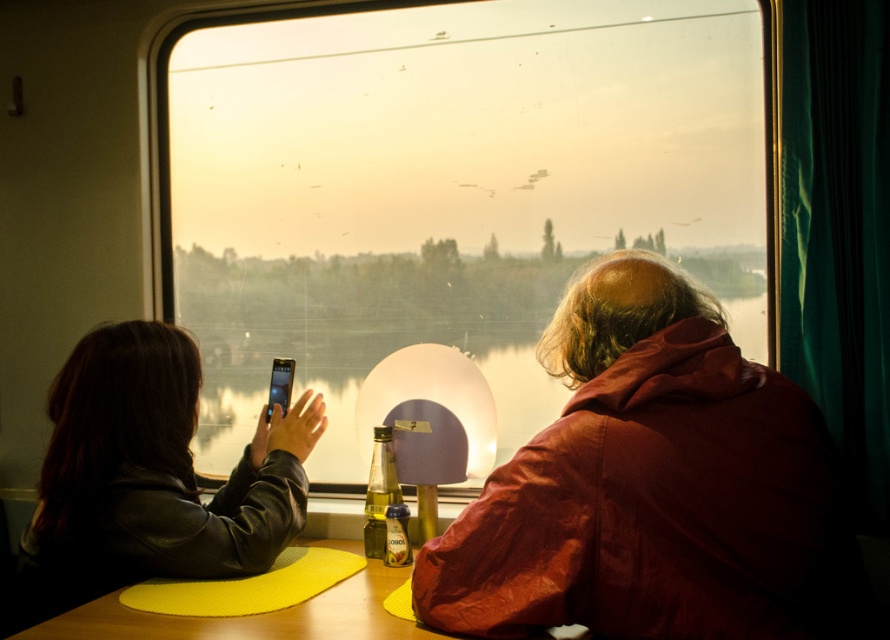
Identify the location of matte red jacket at center. The image size is (890, 640). (653, 486).

Who is higher up, matte red jacket at center or transparent glass water at center?

transparent glass water at center is above.

Does point (795, 536) lie behind point (425, 340)?

No.

Locate an element on the screen. matte red jacket at center is located at coordinates (653, 486).

This screenshot has height=640, width=890. In order to click on transparent glass train window at center in this screenshot , I will do `click(450, 189)`.

Is transparent glass train window at center smaller than leather jacket at left?

No.

Describe the element at coordinates (450, 189) in the screenshot. This screenshot has width=890, height=640. I see `transparent glass train window at center` at that location.

Identify the location of transparent glass train window at center. The image size is (890, 640). tap(450, 189).

Is transparent glass train window at center smaller than translucent glass bottle at center?

Incorrect, transparent glass train window at center is not smaller in size than translucent glass bottle at center.

Describe the element at coordinates (450, 189) in the screenshot. Image resolution: width=890 pixels, height=640 pixels. I see `transparent glass train window at center` at that location.

Between point (227, 360) and point (394, 500), which one is positioned in front?

Positioned in front is point (394, 500).

Find the location of a particular element. transparent glass train window at center is located at coordinates (450, 189).